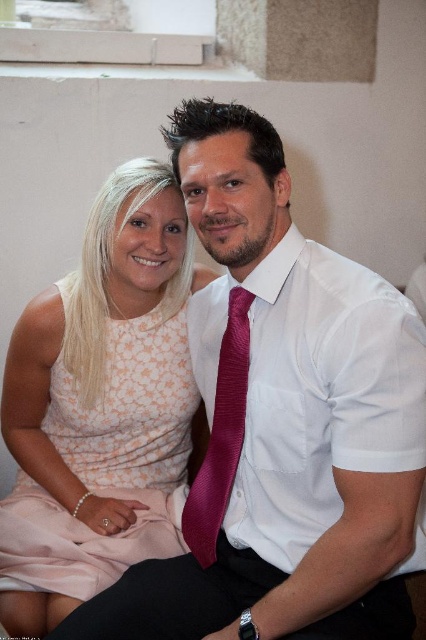
Is point (31, 588) positioned before point (339, 422)?

No, (31, 588) is behind (339, 422).

Between pink lace dress at center and white satin dress shirt at center, which one is positioned lower?

white satin dress shirt at center is lower down.

Find the location of a particular element. The height and width of the screenshot is (640, 426). pink lace dress at center is located at coordinates (98, 404).

Does pink lace dress at center have a smaller size compared to satin burgundy tie at center?

→ Actually, pink lace dress at center might be larger than satin burgundy tie at center.

Which is more to the left, pink lace dress at center or satin burgundy tie at center?

From the viewer's perspective, pink lace dress at center appears more on the left side.

The image size is (426, 640). In order to click on pink lace dress at center in this screenshot , I will do `click(98, 404)`.

Can you confirm if white satin dress shirt at center is thinner than satin burgundy tie at center?

Incorrect, white satin dress shirt at center's width is not less than satin burgundy tie at center's.

Identify the location of white satin dress shirt at center. (322, 394).

I want to click on white satin dress shirt at center, so click(x=322, y=394).